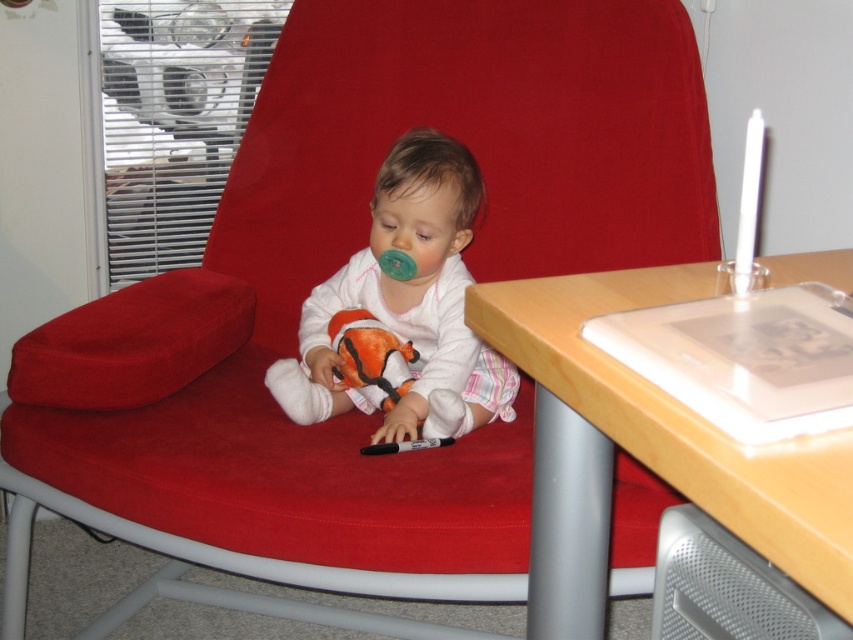
Question: Which of the following is the farthest from the observer?

Choices:
 (A) (573, 608)
 (B) (341, 374)

Answer: (B)

Question: Does wooden table at lower right lie in front of white soft baby at center?

Choices:
 (A) yes
 (B) no

Answer: (A)

Question: Is wooden table at lower right thinner than white soft baby at center?

Choices:
 (A) yes
 (B) no

Answer: (B)

Question: Can you confirm if wooden table at lower right is thinner than white soft baby at center?

Choices:
 (A) yes
 (B) no

Answer: (B)

Question: Which point appears closest to the camera in this image?

Choices:
 (A) (706, 488)
 (B) (397, 301)

Answer: (A)